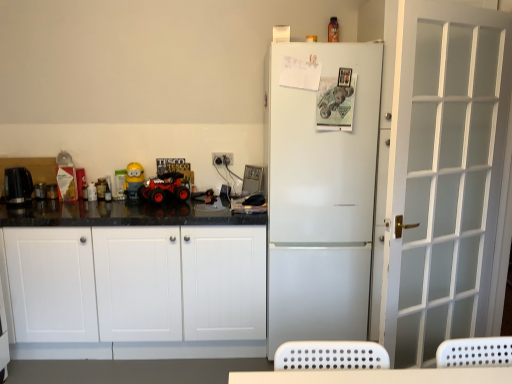
Question: From the image's perspective, is rubberized red toy car at center located above black plastic kettle at left, which appears as the second appliance when viewed from the back?

Choices:
 (A) no
 (B) yes

Answer: (A)

Question: Is rubberized red toy car at center wider than black plastic kettle at left, which appears as the second appliance when viewed from the back?

Choices:
 (A) yes
 (B) no

Answer: (A)

Question: From a real-world perspective, does rubberized red toy car at center sit lower than black plastic kettle at left, which appears as the second appliance when viewed from the back?

Choices:
 (A) no
 (B) yes

Answer: (B)

Question: Is rubberized red toy car at center positioned before black plastic kettle at left, the 1th appliance positioned from the front?

Choices:
 (A) no
 (B) yes

Answer: (B)

Question: Is rubberized red toy car at center bigger than black plastic kettle at left, which appears as the second appliance when viewed from the back?

Choices:
 (A) yes
 (B) no

Answer: (A)

Question: Is rubberized red toy car at center taller than black plastic kettle at left, the 1th appliance positioned from the front?

Choices:
 (A) yes
 (B) no

Answer: (B)

Question: Is black plastic kettle at left, the 1th appliance positioned from the front, inside white matte refrigerator at center?

Choices:
 (A) yes
 (B) no

Answer: (B)

Question: From the image's perspective, is white matte refrigerator at center beneath black plastic kettle at left, the 1th appliance positioned from the front?

Choices:
 (A) no
 (B) yes

Answer: (B)

Question: Is white matte refrigerator at center wider than black plastic kettle at left, which appears as the second appliance when viewed from the back?

Choices:
 (A) yes
 (B) no

Answer: (A)

Question: Is white matte refrigerator at center closer to the viewer compared to black plastic kettle at left, which appears as the second appliance when viewed from the back?

Choices:
 (A) yes
 (B) no

Answer: (A)

Question: Is white matte refrigerator at center aimed at black plastic kettle at left, the 1th appliance positioned from the front?

Choices:
 (A) yes
 (B) no

Answer: (B)

Question: Can you confirm if white matte refrigerator at center is shorter than black plastic kettle at left, which appears as the second appliance when viewed from the back?

Choices:
 (A) yes
 (B) no

Answer: (B)

Question: Does white frosted glass door at right turn towards rubberized red toy car at center?

Choices:
 (A) yes
 (B) no

Answer: (B)